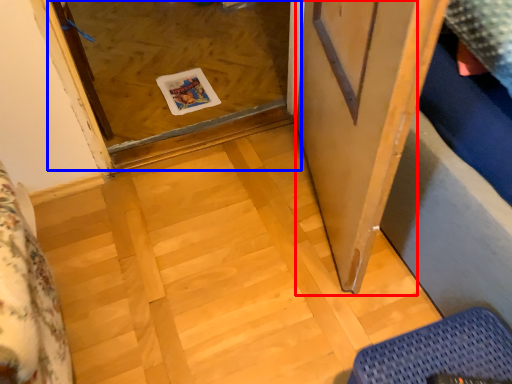
Question: Among these objects, which one is nearest to the camera, screen door (highlighted by a red box) or glass door (highlighted by a blue box)?

Choices:
 (A) screen door
 (B) glass door

Answer: (A)